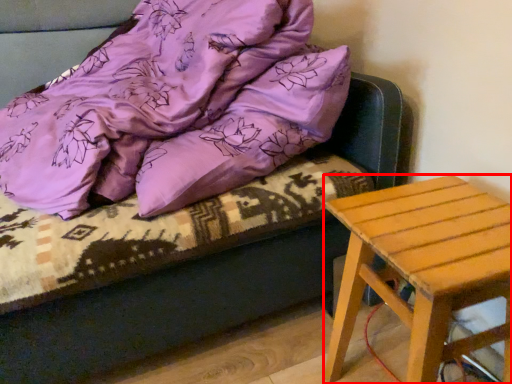
Question: From the image's perspective, where is stool (annotated by the red box) located relative to blanket?

Choices:
 (A) above
 (B) below

Answer: (B)